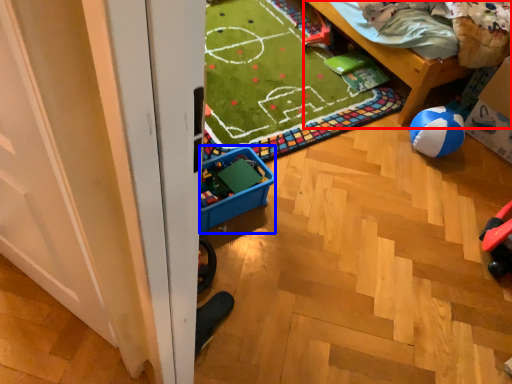
Question: Which object appears closest to the camera in this image, furniture (highlighted by a red box) or storage box (highlighted by a blue box)?

Choices:
 (A) furniture
 (B) storage box

Answer: (B)